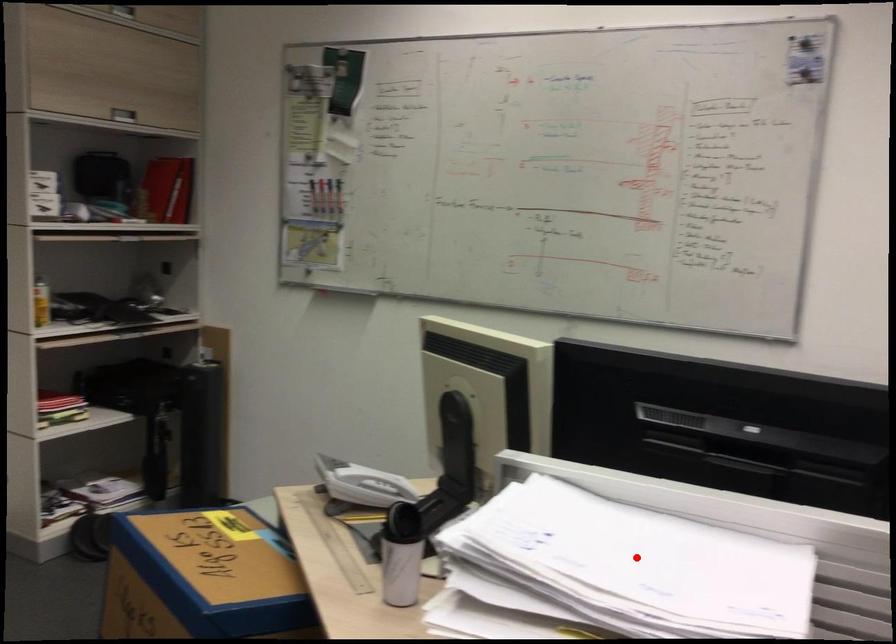
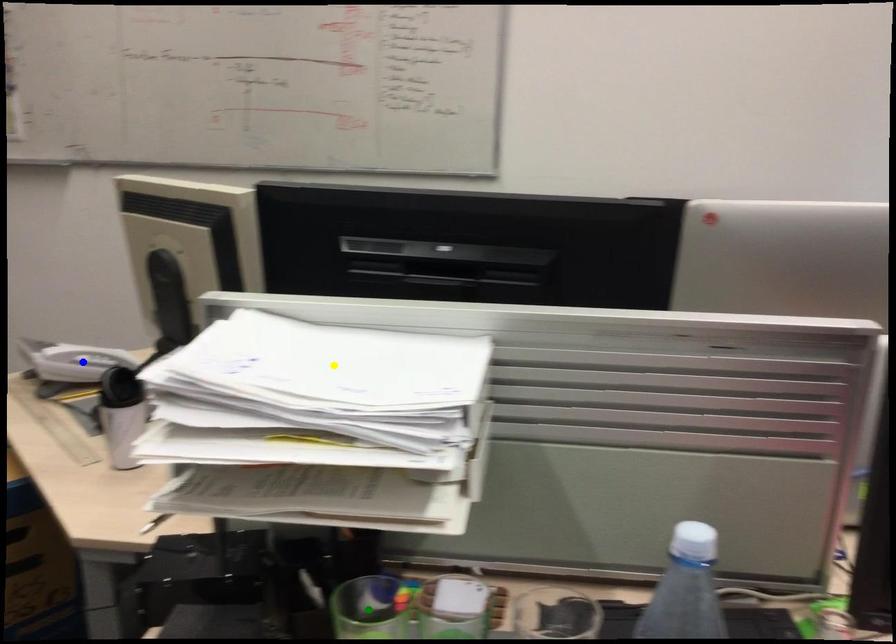
Question: I am providing you with two images of the same scene from different viewpoints. A red point is marked on the first image. You are given multiple points on the second image. Which mark in image 2 goes with the point in image 1?

Choices:
 (A) green point
 (B) yellow point
 (C) blue point

Answer: (B)